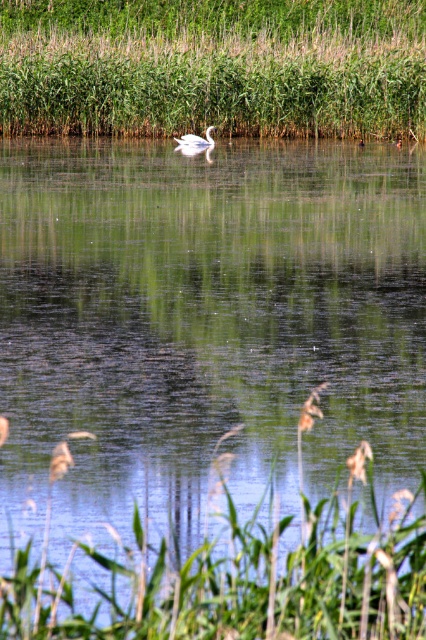
Question: Which point is farther from the camera taking this photo?

Choices:
 (A) (85, 22)
 (B) (245, 602)

Answer: (A)

Question: Is green leafy grass at lower center to the left of white glossy swan at center from the viewer's perspective?

Choices:
 (A) no
 (B) yes

Answer: (A)

Question: Can you confirm if green leafy grass at lower center is smaller than white glossy swan at center?

Choices:
 (A) no
 (B) yes

Answer: (A)

Question: Which point is closer to the camera?

Choices:
 (A) (209, 138)
 (B) (321, 593)

Answer: (B)

Question: Is green grass at upper center to the left of white glossy swan at center from the viewer's perspective?

Choices:
 (A) yes
 (B) no

Answer: (A)

Question: Which object is the farthest from the green grass at upper center?

Choices:
 (A) green leafy grass at lower center
 (B) white glossy swan at center

Answer: (A)